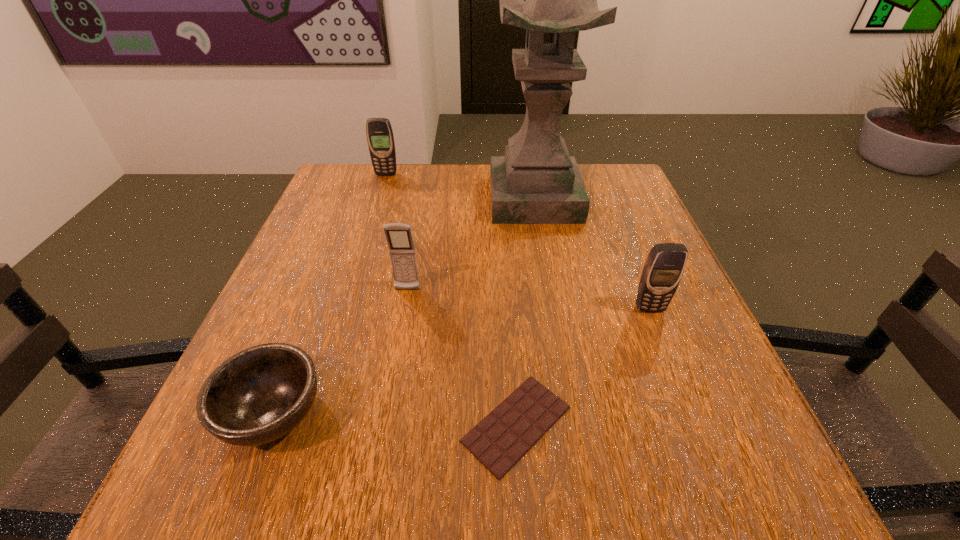
I want to click on the fifth nearest object, so click(x=537, y=182).

Where is `the tallest object`? The height and width of the screenshot is (540, 960). the tallest object is located at coordinates (537, 182).

Where is `the second farthest cellular telephone`? This screenshot has width=960, height=540. the second farthest cellular telephone is located at coordinates (399, 237).

Where is `the third farthest object`? The image size is (960, 540). the third farthest object is located at coordinates (399, 237).

You are a GUI agent. You are given a task and a screenshot of the screen. Output one action in this format:
    pyautogui.click(x=<x>, y=<y>)
    Task: Click on the farthest cellular telephone
    This screenshot has width=960, height=540.
    Given the screenshot: What is the action you would take?
    pyautogui.click(x=380, y=138)

Locate an element on the screen. Image resolution: width=960 pixels, height=540 pixels. the leftmost cellular telephone is located at coordinates (380, 138).

Locate an element on the screen. the fourth farthest object is located at coordinates (664, 267).

This screenshot has width=960, height=540. Find the location of `the nearest cellular telephone`. the nearest cellular telephone is located at coordinates (664, 267).

Image resolution: width=960 pixels, height=540 pixels. I want to click on bowl, so click(260, 394).

Identify the location of chocolate bar. The height and width of the screenshot is (540, 960). (498, 441).